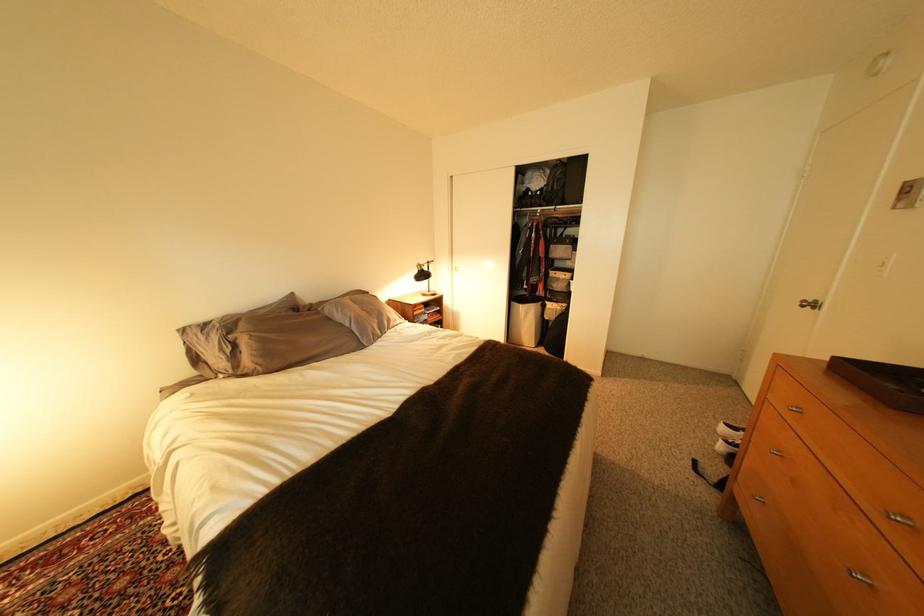
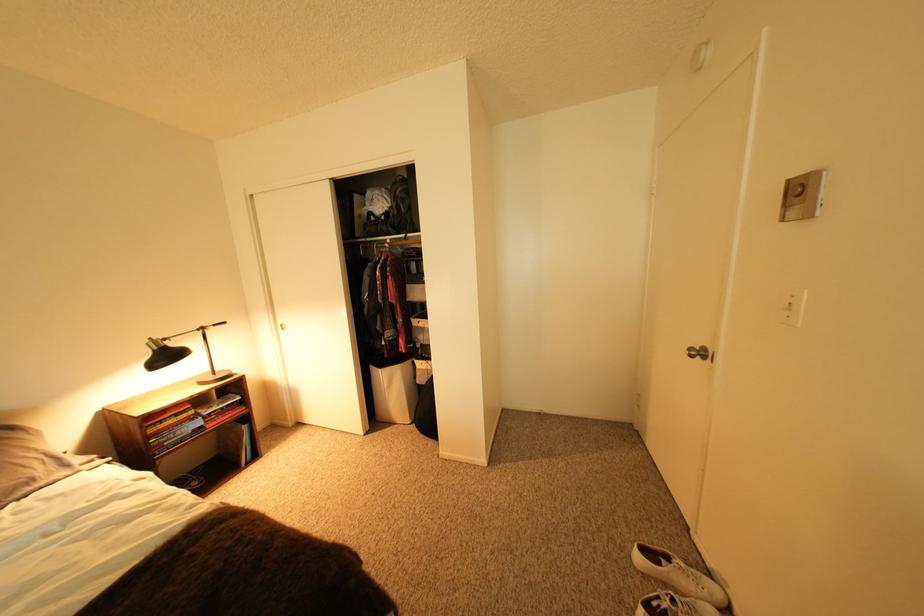
The point at (817, 302) is marked in the first image. Where is the corresponding point in the second image?

(703, 351)